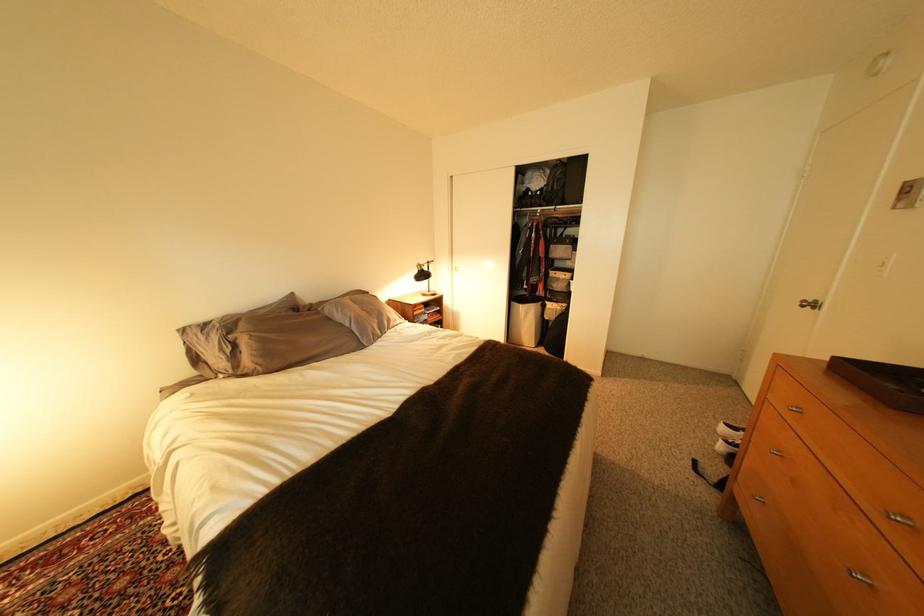
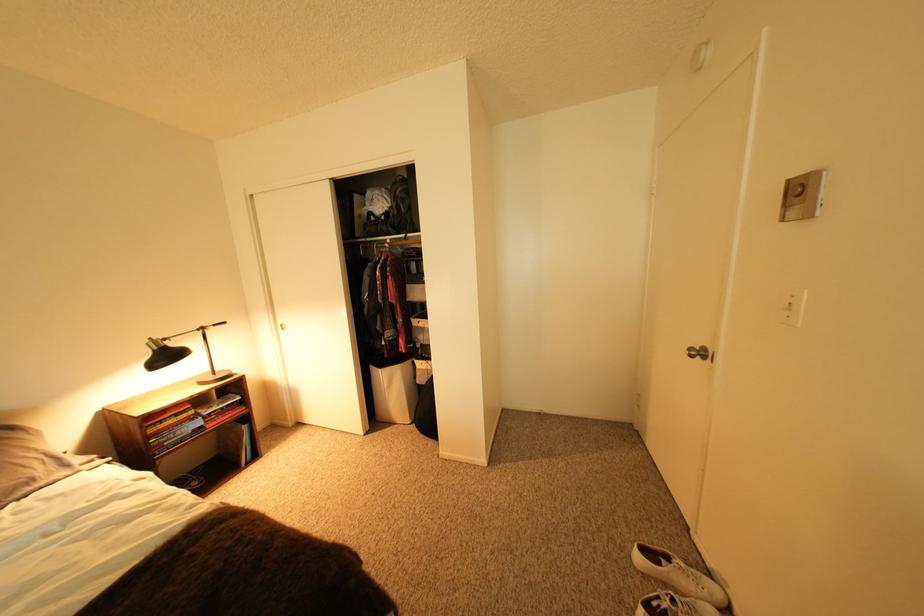
The point at (817, 302) is marked in the first image. Where is the corresponding point in the second image?

(703, 351)